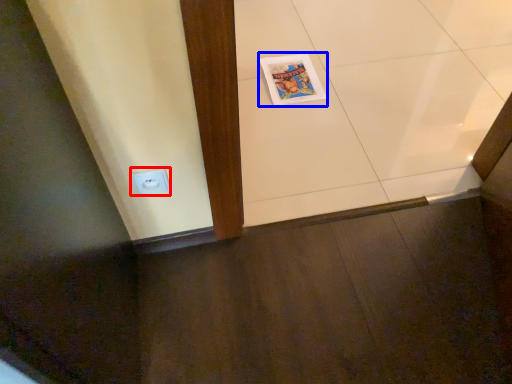
Question: Which object appears closest to the camera in this image, electric outlet (highlighted by a red box) or comic book (highlighted by a blue box)?

Choices:
 (A) electric outlet
 (B) comic book

Answer: (A)